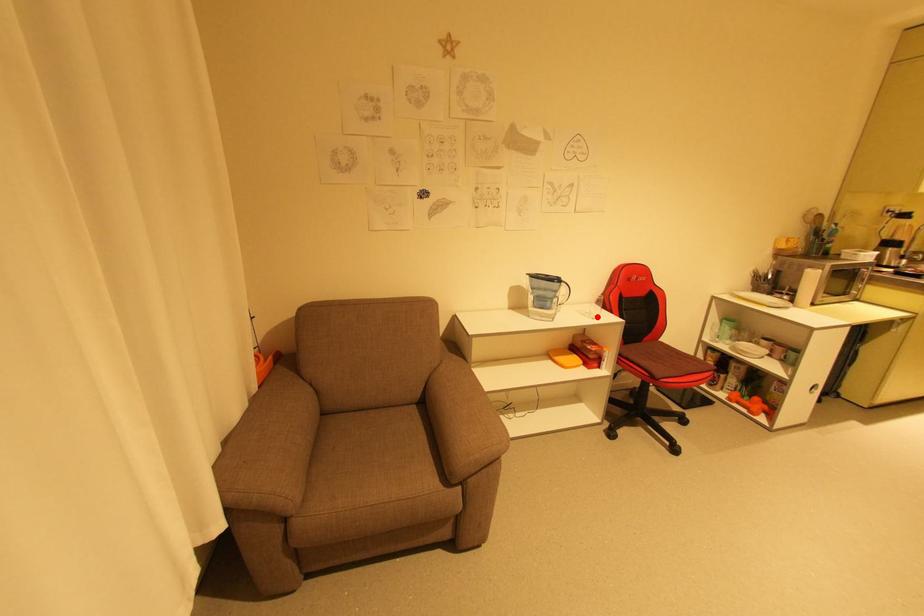
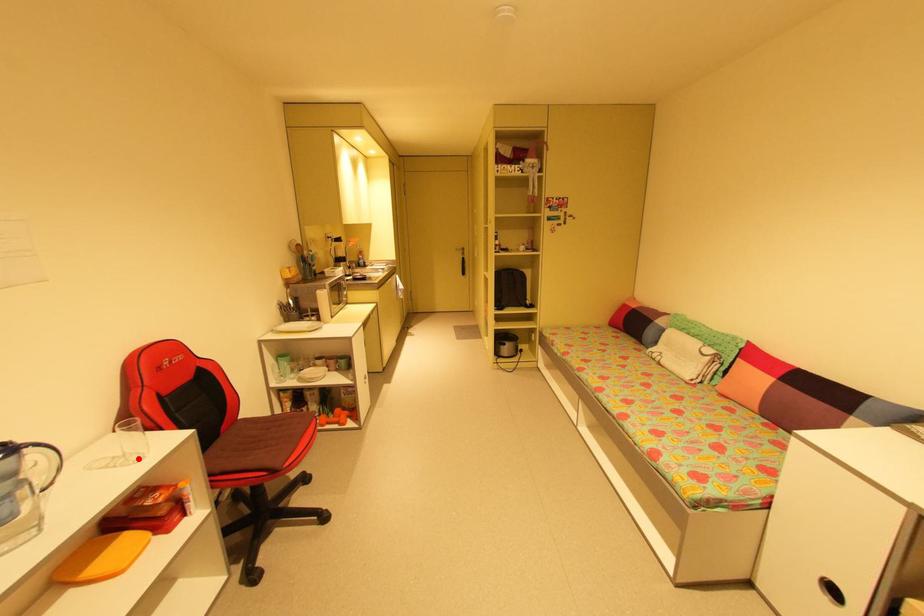
I am providing you with two images of the same scene from different viewpoints. A red point is marked on the first image and another point is marked on the second image. Do the highlighted points in image1 and image2 indicate the same real-world spot?

Yes